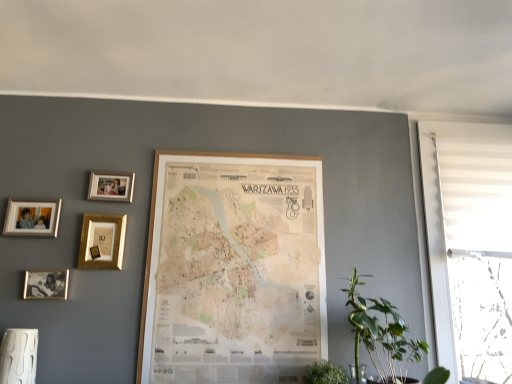
Question: Visually, is silver metallic photo frame at upper left, arranged as the 1th picture frame when viewed from the left, positioned to the left or to the right of green leafy plant at lower center, the first houseplant positioned from the left?

Choices:
 (A) left
 (B) right

Answer: (A)

Question: In terms of size, does silver metallic photo frame at upper left, the 5th picture frame when ordered from right to left, appear bigger or smaller than green leafy plant at lower center, which is the 2th houseplant from right to left?

Choices:
 (A) small
 (B) big

Answer: (A)

Question: Which object is positioned closest to the white fabric window at right?

Choices:
 (A) green leafy plant at lower right, the 2th houseplant positioned from the left
 (B) green leafy plant at lower right
 (C) matte gold photo frame at lower left, placed as the 2th picture frame when sorted from left to right
 (D) gold metallic photo frame at upper left, the 4th picture frame positioned from the left
 (E) wooden map at center, which is the fifth picture frame from left to right

Answer: (A)

Question: Estimate the real-world distances between objects in this image. Which object is farther from the green leafy plant at lower center, which is the 2th houseplant from right to left?

Choices:
 (A) green leafy plant at lower right
 (B) matte gold photo frame at lower left, acting as the 4th picture frame starting from the right
 (C) silver metallic photo frame at upper left, arranged as the 1th picture frame when viewed from the left
 (D) gold metallic picture frame at upper left, placed as the third picture frame when sorted from left to right
 (E) white fabric window at right

Answer: (C)